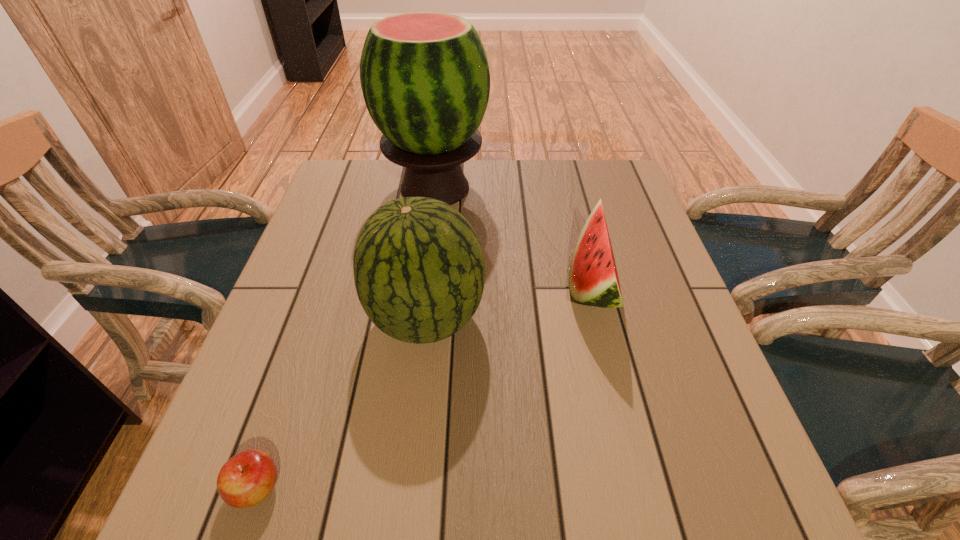
I want to click on vacant space located on the outer rind of the shortest watermelon, so click(x=391, y=285).

This screenshot has width=960, height=540. Find the location of `free location located on the outer rind of the shortest watermelon`. free location located on the outer rind of the shortest watermelon is located at coordinates click(391, 285).

The width and height of the screenshot is (960, 540). What are the coordinates of `free space located on the back of the leftmost object` in the screenshot? It's located at (321, 302).

The image size is (960, 540). Find the location of `object at the far edge`. object at the far edge is located at coordinates (425, 79).

Identify the location of object that is at the near edge. This screenshot has width=960, height=540. (246, 479).

Locate an element on the screen. Image resolution: width=960 pixels, height=540 pixels. watermelon that is at the left edge is located at coordinates (425, 79).

Image resolution: width=960 pixels, height=540 pixels. I want to click on apple at the left edge, so (246, 479).

This screenshot has width=960, height=540. Identify the location of object at the right edge. (593, 279).

You are a GUI agent. You are given a task and a screenshot of the screen. Output one action in this format:
    pyautogui.click(x=<x>, y=<y>)
    Task: Click on the object present at the far left corner
    The image size is (960, 540).
    Given the screenshot: What is the action you would take?
    pyautogui.click(x=425, y=79)

This screenshot has width=960, height=540. Identify the location of object at the near left corner. (246, 479).